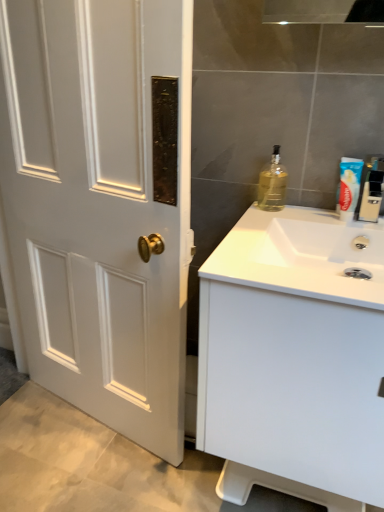
Question: Is blue plastic toothpaste at upper right next to clear plastic toothpaste tube at upper right, which appears as the second bottle when viewed from the left, and touching it?

Choices:
 (A) no
 (B) yes

Answer: (B)

Question: From the image's perspective, is blue plastic toothpaste at upper right located above clear plastic toothpaste tube at upper right, which appears as the second bottle when viewed from the left?

Choices:
 (A) yes
 (B) no

Answer: (A)

Question: Is blue plastic toothpaste at upper right taller than clear plastic toothpaste tube at upper right, marked as the first bottle in a right-to-left arrangement?

Choices:
 (A) yes
 (B) no

Answer: (B)

Question: Would you say blue plastic toothpaste at upper right is a long distance from clear plastic toothpaste tube at upper right, which appears as the second bottle when viewed from the left?

Choices:
 (A) yes
 (B) no

Answer: (B)

Question: Does blue plastic toothpaste at upper right contain clear plastic toothpaste tube at upper right, which appears as the second bottle when viewed from the left?

Choices:
 (A) no
 (B) yes

Answer: (A)

Question: Considering the relative sizes of blue plastic toothpaste at upper right and clear plastic toothpaste tube at upper right, marked as the first bottle in a right-to-left arrangement, in the image provided, is blue plastic toothpaste at upper right wider than clear plastic toothpaste tube at upper right, marked as the first bottle in a right-to-left arrangement,?

Choices:
 (A) yes
 (B) no

Answer: (B)

Question: Is the depth of white glossy sink at right less than that of blue plastic toothpaste at upper right?

Choices:
 (A) no
 (B) yes

Answer: (B)

Question: Can you confirm if white glossy sink at right is wider than blue plastic toothpaste at upper right?

Choices:
 (A) no
 (B) yes

Answer: (B)

Question: Is white glossy sink at right in contact with blue plastic toothpaste at upper right?

Choices:
 (A) no
 (B) yes

Answer: (A)

Question: Does white glossy sink at right have a lesser height compared to blue plastic toothpaste at upper right?

Choices:
 (A) no
 (B) yes

Answer: (B)

Question: Is white glossy sink at right aimed at blue plastic toothpaste at upper right?

Choices:
 (A) yes
 (B) no

Answer: (B)

Question: Considering the relative positions of white glossy sink at right and blue plastic toothpaste at upper right in the image provided, is white glossy sink at right behind blue plastic toothpaste at upper right?

Choices:
 (A) no
 (B) yes

Answer: (A)

Question: From a real-world perspective, does white matte cabinet at right sit lower than translucent glass bottle at upper right, which ranks as the 1th bottle in left-to-right order?

Choices:
 (A) yes
 (B) no

Answer: (A)